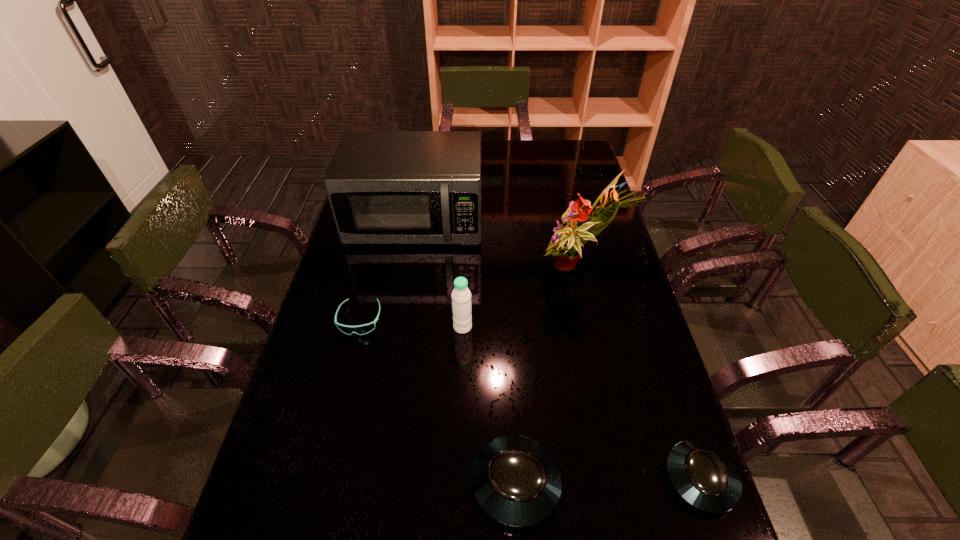
Considering the uniform spacing of saucers, where should an additional saucer be positioned on the left? Please locate a free spot. Please provide its 2D coordinates. Your answer should be formatted as a tuple, i.e. [(x, y)], where the tuple contains the x and y coordinates of a point satisfying the conditions above.

[(328, 487)]